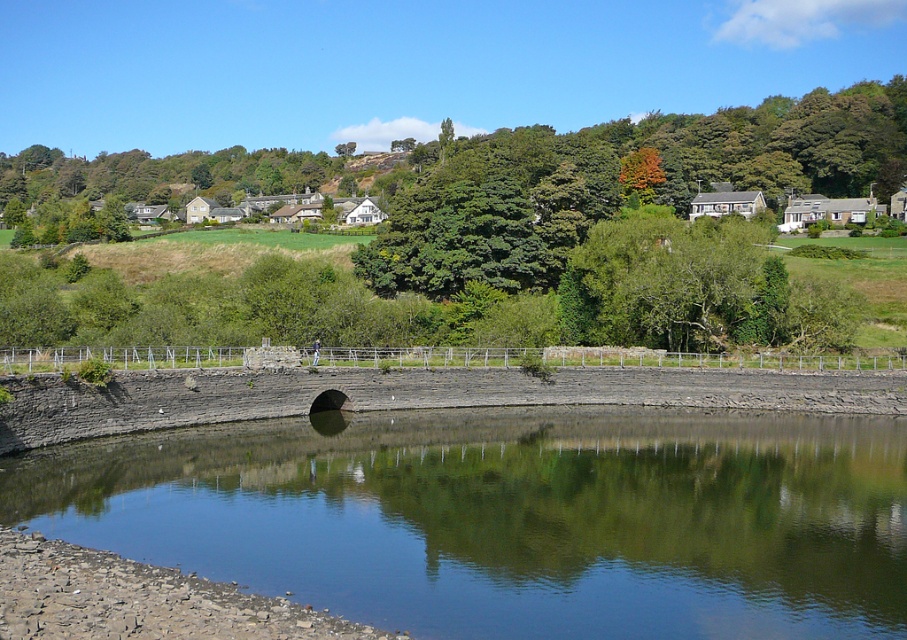
Question: Which object is closer to the camera taking this photo?

Choices:
 (A) clear water at center
 (B) green leafy tree at center
 (C) green leafy tree at upper center

Answer: (A)

Question: Can you confirm if clear water at center is positioned above green leafy tree at center?

Choices:
 (A) no
 (B) yes

Answer: (A)

Question: Among these points, which one is nearest to the camera?

Choices:
 (A) (639, 252)
 (B) (265, 552)

Answer: (B)

Question: Is green leafy tree at upper center behind green leafy tree at center?

Choices:
 (A) yes
 (B) no

Answer: (A)

Question: Which object appears closest to the camera in this image?

Choices:
 (A) clear water at center
 (B) green leafy tree at center

Answer: (A)

Question: Can you confirm if clear water at center is positioned below green leafy tree at upper center?

Choices:
 (A) no
 (B) yes

Answer: (B)